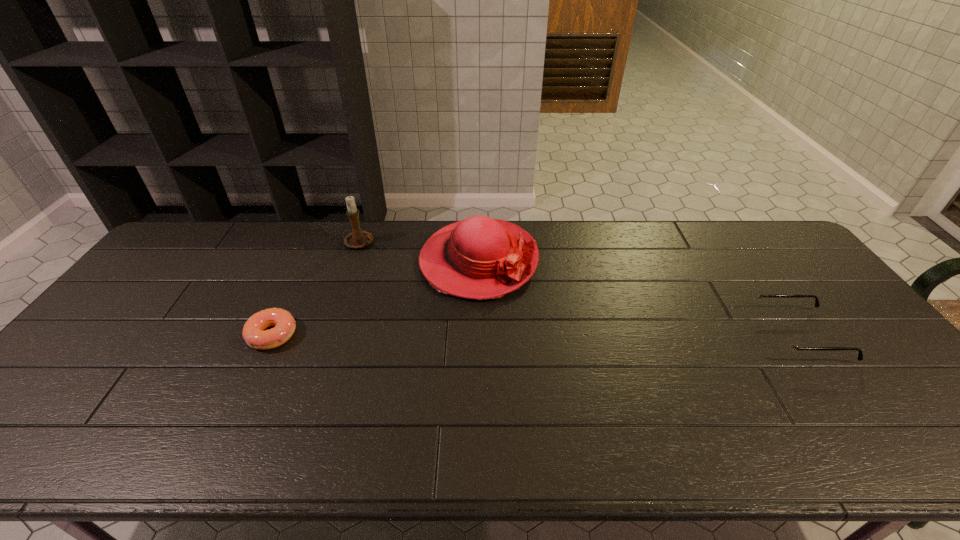
Locate an element on the screen. The width and height of the screenshot is (960, 540). vacant position located 0.060m at the hinge ends of the spectacles is located at coordinates click(x=741, y=335).

The width and height of the screenshot is (960, 540). I want to click on free space located 0.140m at the hinge ends of the spectacles, so click(711, 335).

The height and width of the screenshot is (540, 960). I want to click on free point located at the front of the third shortest object with a bow, so click(x=619, y=383).

At what (x,y) coordinates should I click in order to perform the action: click on free point located 0.320m at the front of the third shortest object with a bow. Please return your answer as a coordinate pair (x, y). Image resolution: width=960 pixels, height=540 pixels. Looking at the image, I should click on (597, 365).

Locate an element on the screen. This screenshot has width=960, height=540. vacant area situated 0.300m at the front of the third shortest object with a bow is located at coordinates (591, 360).

At what (x,y) coordinates should I click in order to perform the action: click on vacant space located 0.200m on the side of the third object from right to left with the handle. Please return your answer as a coordinate pair (x, y). Looking at the image, I should click on (402, 279).

I want to click on free space located 0.090m on the side of the third object from right to left with the handle, so click(x=383, y=262).

Locate an element on the screen. The height and width of the screenshot is (540, 960). free point located 0.180m on the side of the third object from right to left with the handle is located at coordinates (398, 276).

Where is `hat located in the far edge section of the desktop`? This screenshot has width=960, height=540. hat located in the far edge section of the desktop is located at coordinates (479, 258).

This screenshot has width=960, height=540. Find the location of `candle holder that is positioned at the far edge`. candle holder that is positioned at the far edge is located at coordinates (357, 239).